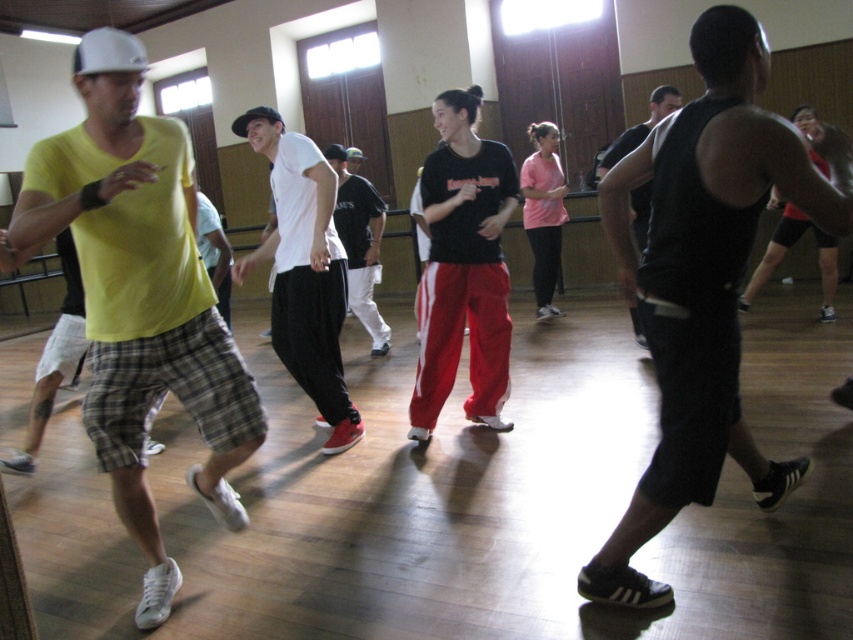
You are a photographer trying to capture a clear shot of the black sleeveless shirt at center and the black matte tank top at center. Which one is closer to the camera?

The black sleeveless shirt at center is positioned under the black matte tank top at center, so the black matte tank top at center is closer to the camera.

You are a dance instructor preparing to distribute t shirts to participants. You have two black shirts in the front row, one labeled as black sleeveless shirt at center and the other as black matte tank top at center. Which one has a wider cut?

The black sleeveless shirt at center has a wider cut than the black matte tank top at center as per their widths.